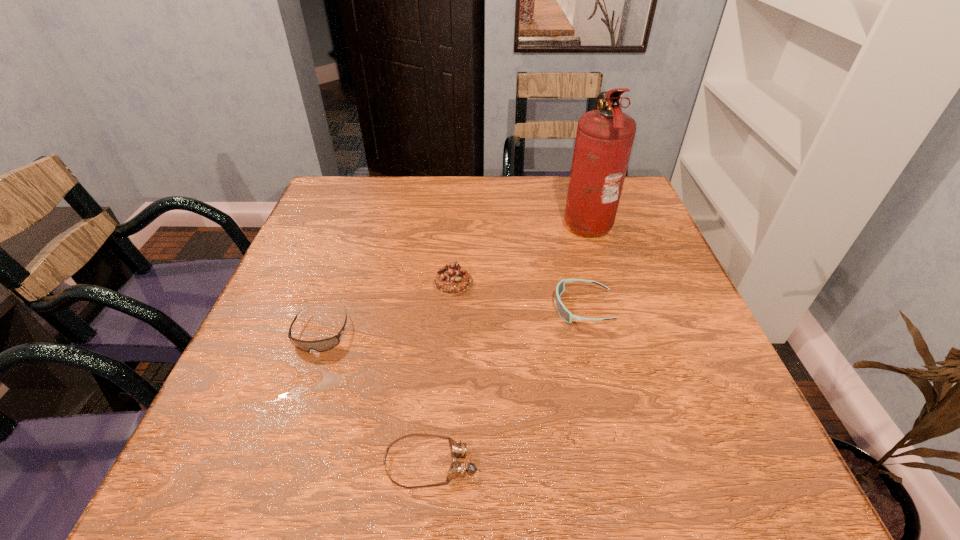
The height and width of the screenshot is (540, 960). Find the location of `vacant position in the image that satisfies the following two spatial constraints: 1. at the front of the tallest object where the nozzle is aimed; 2. on the lenses of the leftmost object`. vacant position in the image that satisfies the following two spatial constraints: 1. at the front of the tallest object where the nozzle is aimed; 2. on the lenses of the leftmost object is located at coordinates (620, 333).

Image resolution: width=960 pixels, height=540 pixels. In order to click on vacant area in the image that satisfies the following two spatial constraints: 1. at the front of the farthest object where the nozzle is aimed; 2. on the lenses of the leftmost object in this screenshot , I will do `click(620, 333)`.